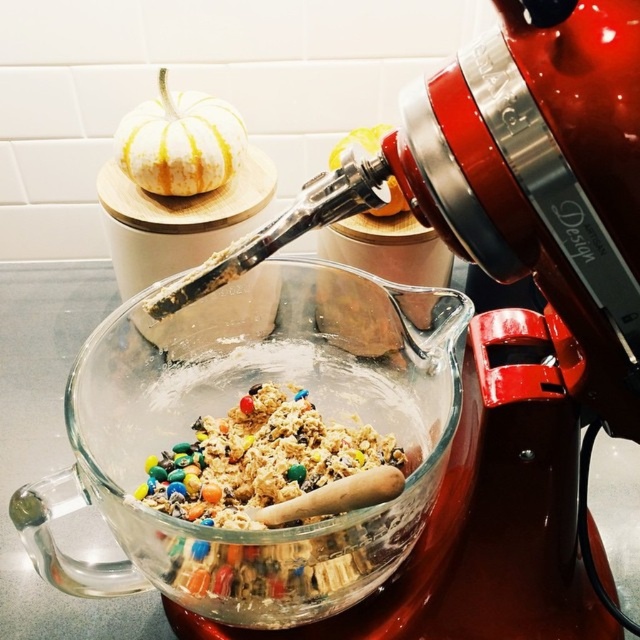
Question: Which point is closer to the camera?

Choices:
 (A) (150, 486)
 (B) (220, 100)

Answer: (A)

Question: Does multicolored crunchy cookie dough at center appear on the left side of white matte pumpkin at upper left?

Choices:
 (A) no
 (B) yes

Answer: (A)

Question: Is transparent glass bowl at center below multicolored crunchy cookie dough at center?

Choices:
 (A) no
 (B) yes

Answer: (A)

Question: Is multicolored crunchy cookie dough at center further to camera compared to white matte pumpkin at upper left?

Choices:
 (A) yes
 (B) no

Answer: (B)

Question: Which of the following is the closest to the observer?

Choices:
 (A) white matte pumpkin at upper left
 (B) multicolored crunchy cookie dough at center

Answer: (B)

Question: Among these objects, which one is farthest from the camera?

Choices:
 (A) white matte pumpkin at upper left
 (B) transparent glass bowl at center

Answer: (A)